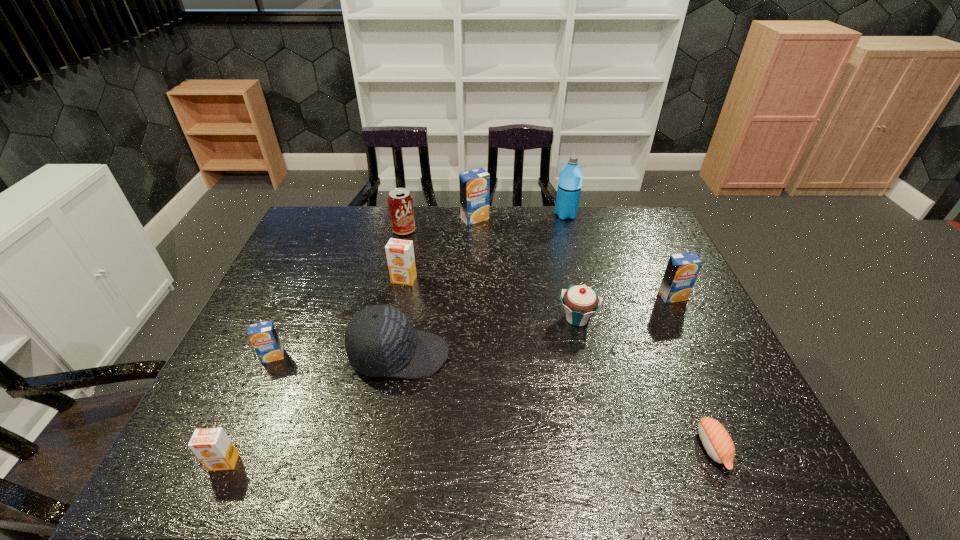
Where is `vacant position located on the back of the rightmost blue orange_juice`? This screenshot has height=540, width=960. vacant position located on the back of the rightmost blue orange_juice is located at coordinates pyautogui.click(x=641, y=232).

This screenshot has width=960, height=540. In order to click on blank space located 0.140m at the front of the baseball cap where the brim is located in this screenshot , I will do `click(503, 355)`.

Where is `free space located on the right of the cupcake`? Image resolution: width=960 pixels, height=540 pixels. free space located on the right of the cupcake is located at coordinates (640, 318).

Where is `free region located on the right of the smallest blue orange_juice`? free region located on the right of the smallest blue orange_juice is located at coordinates (425, 356).

This screenshot has height=540, width=960. What are the coordinates of `vacant space situated on the right of the nearest orange juice` in the screenshot? It's located at (338, 462).

The width and height of the screenshot is (960, 540). I want to click on vacant point located 0.100m on the back of the ninth object from left to right, so click(x=687, y=386).

Find the location of a particular element. This screenshot has height=540, width=960. thermos bottle that is at the far edge is located at coordinates (571, 175).

Identify the location of orange_juice at the far edge. (475, 184).

Where is `soda can that is positioned at the far edge`? The image size is (960, 540). soda can that is positioned at the far edge is located at coordinates (400, 202).

In order to click on orange juice at the near edge in this screenshot , I will do `click(212, 446)`.